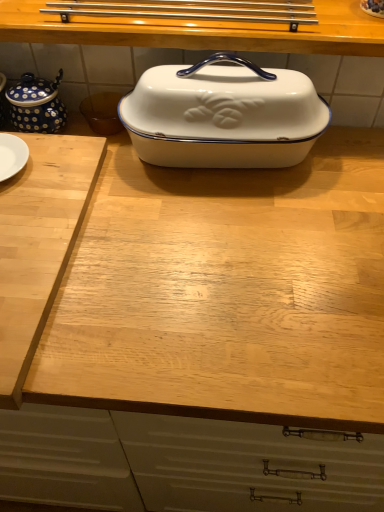
Find the location of a particular element. The height and width of the screenshot is (512, 384). empty space that is ontop of light wood cutting board at left (from a real-world perspective) is located at coordinates (34, 211).